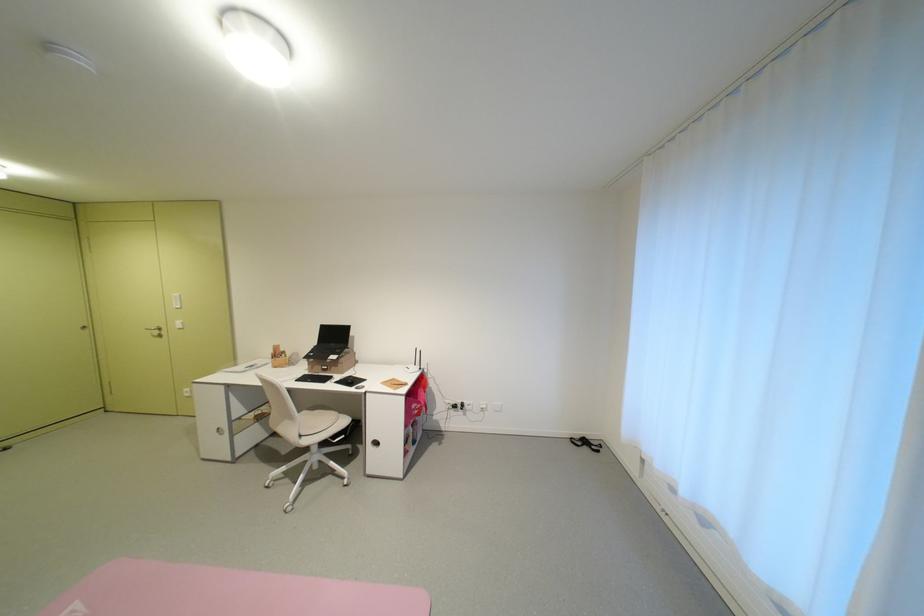
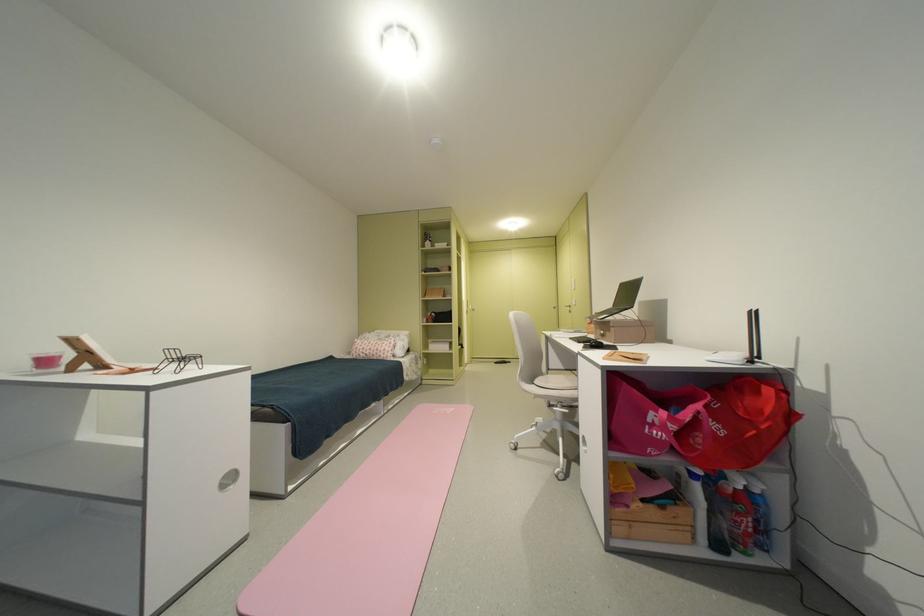
In the second image, find the point that corresponds to [311,436] in the first image.

(543, 383)